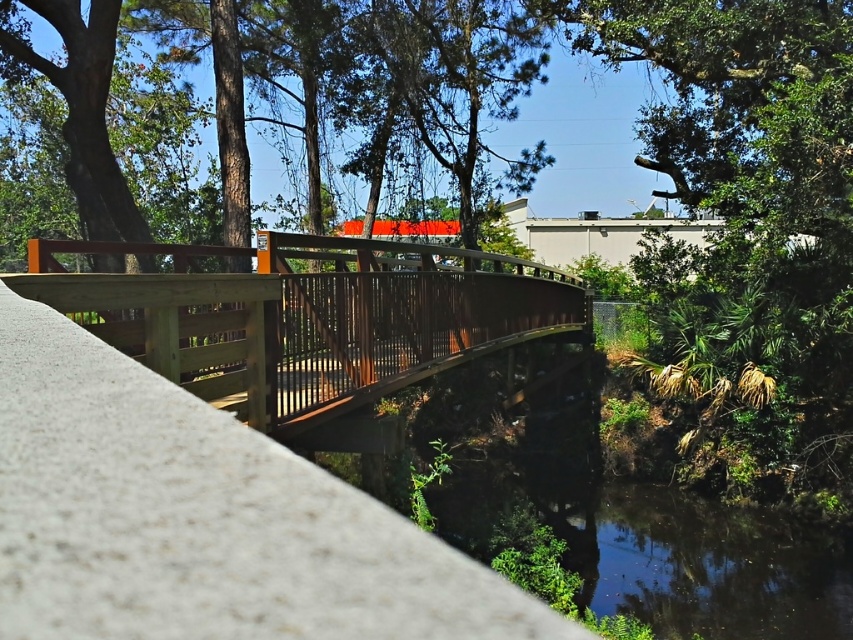
Consider the image. You are standing on the wooden pedestrian bridge crossing over a small dark waterway. You want to sit down to rest. Is there a smooth concrete ledge at center where you can sit?

Yes, there is a smooth concrete ledge at center located at point coordinates of (199, 516) where you can sit.

You are standing on the wooden pedestrian bridge and want to determine which of the two points, point (192,400) or point (238,321), is nearer to you. Based on the scene description, which point is closer?

Point (192,400) is closer to the viewer than point (238,321).

You are a hiker carrying a 15 feet long wooden beam. You need to transport it from the smooth concrete ledge at center to the brown wooden bridge at center. Can you move the beam without breaking it into pieces?

The smooth concrete ledge at center and brown wooden bridge at center are 16.31 feet apart. Since the beam is 15 feet long, it can be moved between them without needing to be broken into pieces as the distance is sufficient.